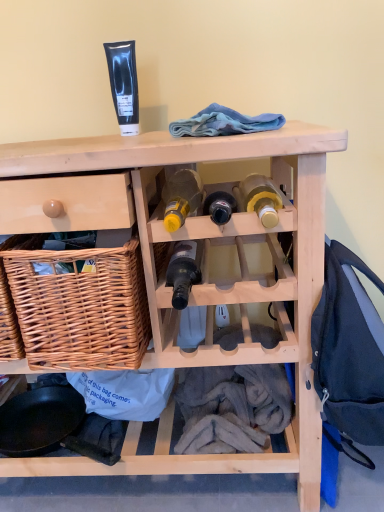
Question: Looking at the image, does blue fleece at upper center, acting as the first clothing starting from the left, seem bigger or smaller compared to yellow glass bottle at center, the first bottle when ordered from left to right?

Choices:
 (A) small
 (B) big

Answer: (B)

Question: Is blue fleece at upper center, placed as the 2th clothing when sorted from bottom to top, in front of or behind yellow glass bottle at center, the third bottle viewed from the right, in the image?

Choices:
 (A) front
 (B) behind

Answer: (B)

Question: Which object is the closest to the black glass tube at upper center?

Choices:
 (A) blue fleece at upper center, placed as the 2th clothing when sorted from bottom to top
 (B) matte yellow glass bottle at center, the first bottle from the right
 (C) translucent glass wine bottle at center, which ranks as the 2th bottle in right-to-left order
 (D) yellow glass bottle at center, the first bottle when ordered from left to right
 (E) dark blue backpack at right, arranged as the 2th clothing when viewed from the top

Answer: (D)

Question: Which is farther from the translucent glass wine bottle at center, which ranks as the 2th bottle in right-to-left order?

Choices:
 (A) woven brown basket at left
 (B) natural wood wine rack at center
 (C) dark blue backpack at right, which is the 2th clothing from left to right
 (D) blue fleece at upper center, which appears as the 2th clothing when viewed from the right
 (E) yellow glass bottle at center, the first bottle when ordered from left to right

Answer: (C)